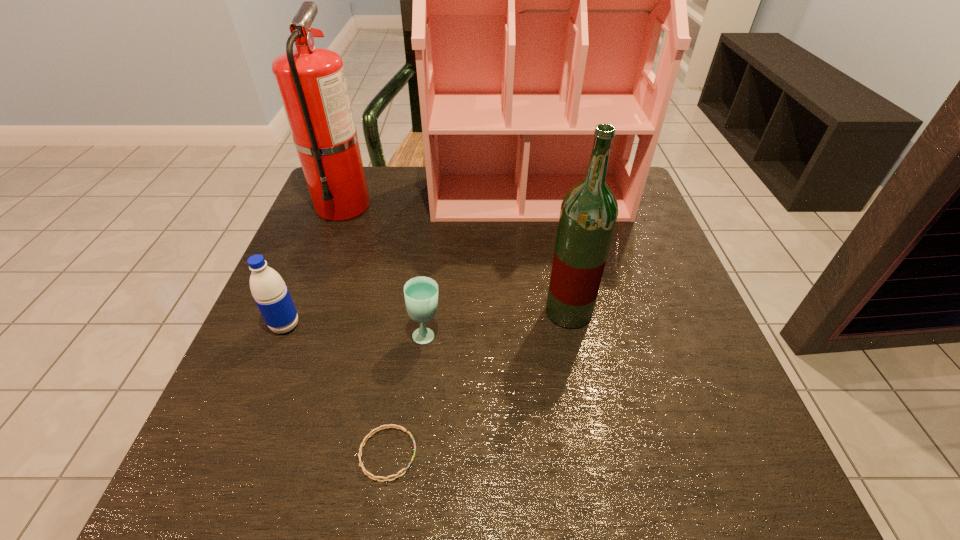
Where is `dollhouse`? dollhouse is located at coordinates (538, 0).

The width and height of the screenshot is (960, 540). Find the location of `fire extinguisher`. fire extinguisher is located at coordinates (311, 82).

The image size is (960, 540). I want to click on liquor, so click(589, 211).

The image size is (960, 540). I want to click on water bottle, so click(271, 295).

Find the location of a particular element. the second shortest object is located at coordinates (421, 293).

Where is `the shortest object`? Image resolution: width=960 pixels, height=540 pixels. the shortest object is located at coordinates (367, 473).

Find the location of `the nearest object`. the nearest object is located at coordinates (367, 473).

Identify the location of vacant region located 0.090m on the front-facing side of the dollhouse. The width and height of the screenshot is (960, 540). (537, 248).

You are a GUI agent. You are given a task and a screenshot of the screen. Output one action in this format:
    pyautogui.click(x=<x>, y=<y>)
    Task: Click on the blank space located at the nozzle of the fire extinguisher
    
    Given the screenshot: What is the action you would take?
    pyautogui.click(x=289, y=347)

Where is `vacant space located on the back of the liquor`? vacant space located on the back of the liquor is located at coordinates (557, 248).